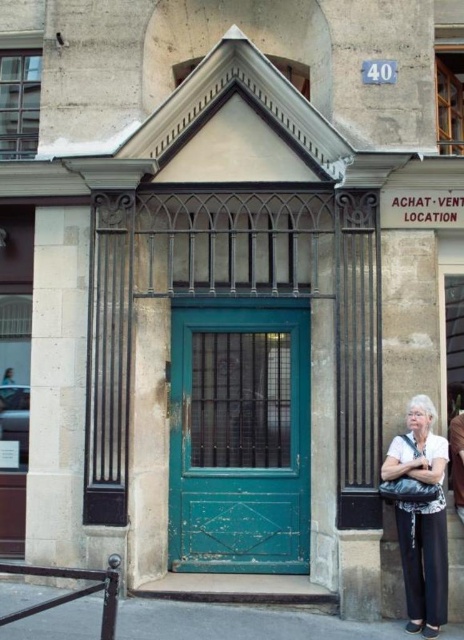
Question: Does green wooden door at center have a larger size compared to white fabric at center?

Choices:
 (A) no
 (B) yes

Answer: (B)

Question: Among these objects, which one is farthest from the camera?

Choices:
 (A) white fabric at center
 (B) green wooden door at center

Answer: (B)

Question: Does green wooden door at center have a smaller size compared to white fabric at center?

Choices:
 (A) yes
 (B) no

Answer: (B)

Question: Which object appears closest to the camera in this image?

Choices:
 (A) green wooden door at center
 (B) white fabric at center

Answer: (B)

Question: Can you confirm if green wooden door at center is bigger than white fabric at center?

Choices:
 (A) no
 (B) yes

Answer: (B)

Question: Which of the following is the farthest from the observer?

Choices:
 (A) (393, 452)
 (B) (174, 474)

Answer: (B)